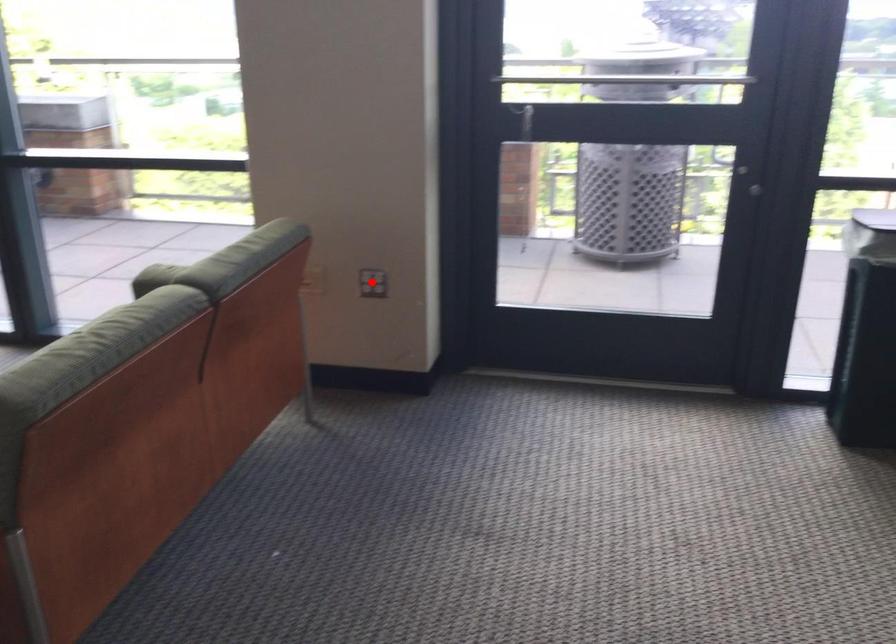
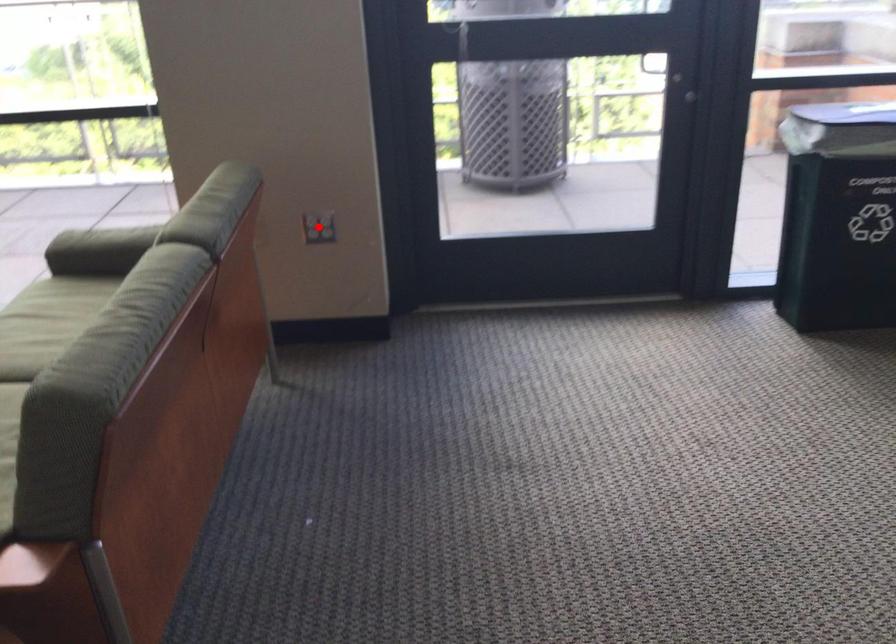
I am providing you with two images of the same scene from different viewpoints. A red point is marked on the first image and another point is marked on the second image. Is the marked point in image1 the same physical position as the marked point in image2?

Yes